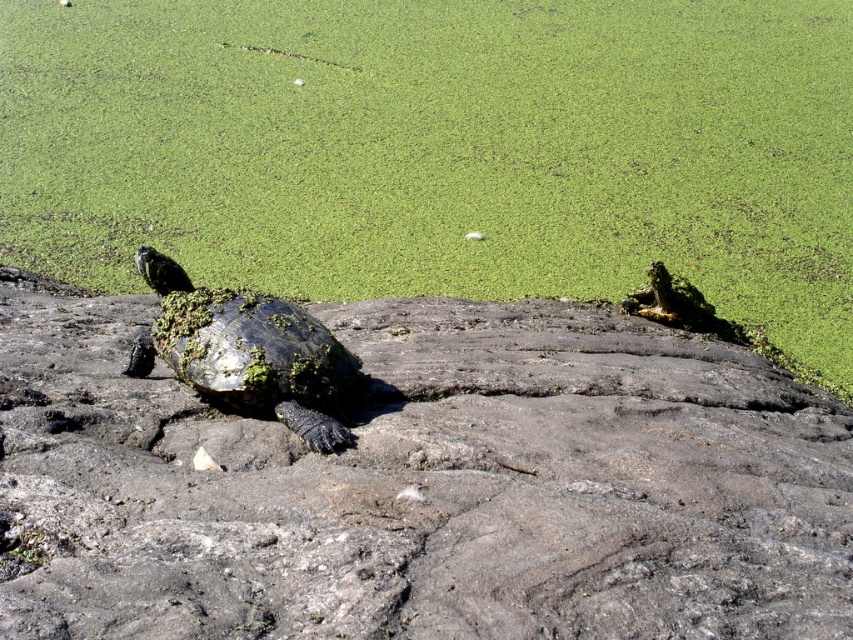
Who is more forward, (56, 454) or (170, 301)?

Point (56, 454) is more forward.

From the picture: Who is more distant from viewer, [735,433] or [198,289]?

Point [198,289]

Identify the location of rough textured rock at center. Image resolution: width=853 pixels, height=640 pixels. (421, 484).

Between green mossy algae at upper left and green mossy tortoise at center, which one has less height?

green mossy tortoise at center is shorter.

Can you confirm if green mossy algae at upper left is bigger than green mossy tortoise at center?

Yes, green mossy algae at upper left is bigger than green mossy tortoise at center.

Which is in front, point (281, 74) or point (287, 336)?

Point (287, 336)

The image size is (853, 640). I want to click on green mossy algae at upper left, so click(440, 148).

Can you confirm if rough textured rock at center is positioned to the right of green mossy algae at upper left?

No, rough textured rock at center is not to the right of green mossy algae at upper left.

Is rough textured rock at center wider than green mossy algae at upper left?

No.

Does point (48, 625) come behind point (215, 196)?

No, (48, 625) is closer to viewer.

Where is `rough textured rock at center`? The height and width of the screenshot is (640, 853). rough textured rock at center is located at coordinates (421, 484).